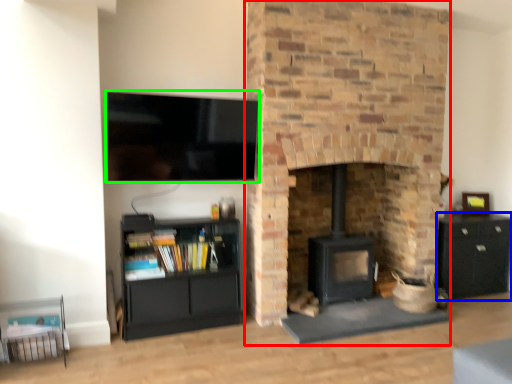
Question: Estimate the real-world distances between objects in this image. Which object is farther from fireplace (highlighted by a red box), cabinetry (highlighted by a blue box) or television (highlighted by a green box)?

Choices:
 (A) cabinetry
 (B) television

Answer: (A)